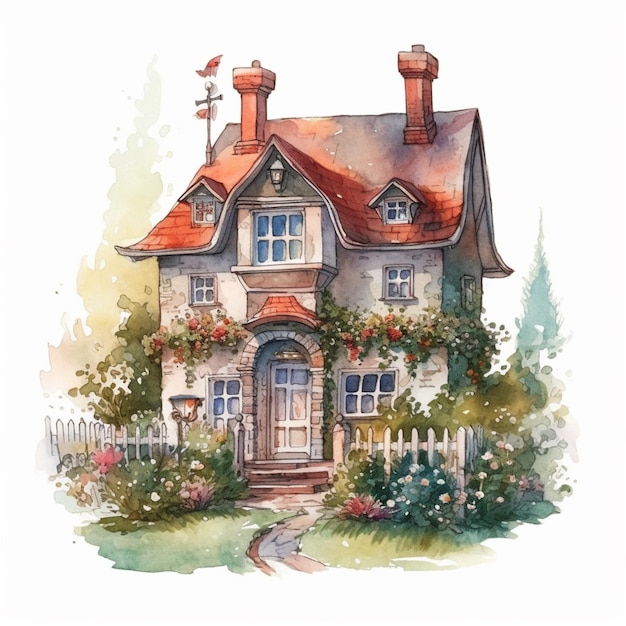
You are a GUI agent. You are given a task and a screenshot of the screen. Output one action in this format:
    pyautogui.click(x=<x>, y=<y>)
    Task: Click on the window
    The image size is (626, 626).
    Given the screenshot: What is the action you would take?
    pyautogui.click(x=357, y=386), pyautogui.click(x=390, y=280), pyautogui.click(x=205, y=285), pyautogui.click(x=212, y=394)